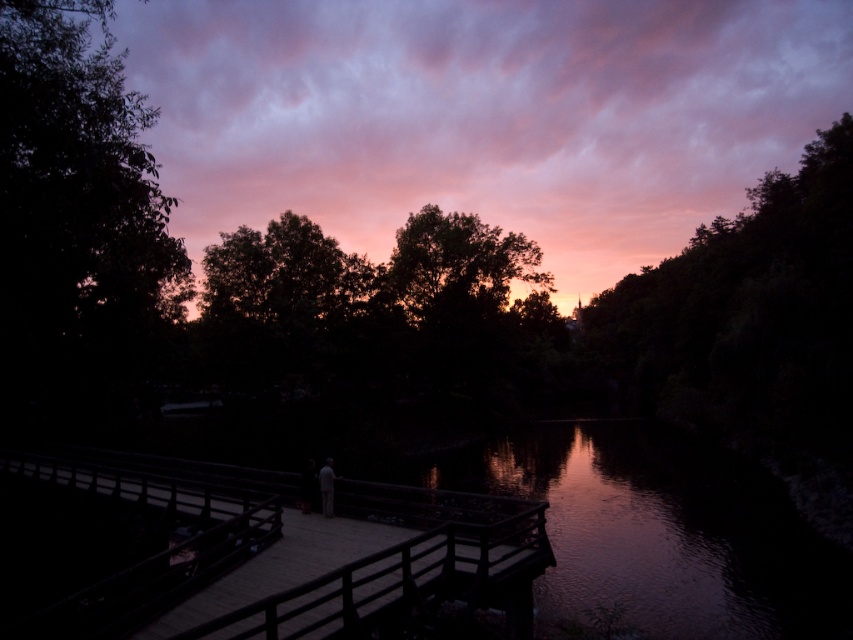
Consider the image. You are standing at the edge of the wooden dock at center. You want to walk to the point with coordinates point (286, 554). Is this point located on the wooden dock at center?

Yes, the point (286, 554) is located on the wooden dock at center as stated in the description.

You are planning to take a photo of the dark green leafy tree at left and the light gray fabric person at center from the shore. Which object should you focus on first if you want to capture both in a single frame without moving the camera?

The dark green leafy tree at left should be focused on first because it is larger in size than the light gray fabric person at center, so it will require more attention to detail to ensure it fits well within the frame.

You are standing on the wooden dock at center and want to walk towards the glossy water at center. Which direction should you move to reach the water?

You should move to the right because the wooden dock at center is to the left of the glossy water at center, so moving right will take you towards the water.